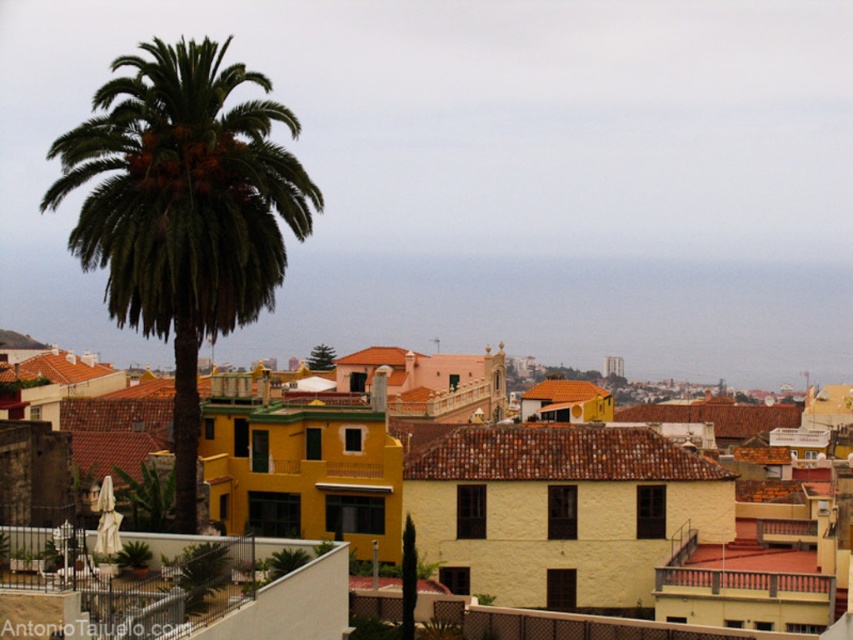
Question: Which point is farther from the camera taking this photo?

Choices:
 (A) (119, 625)
 (B) (262, 83)

Answer: (B)

Question: Does green leafy palm at left appear on the left side of white wrought iron balcony at lower left?

Choices:
 (A) yes
 (B) no

Answer: (A)

Question: Among these objects, which one is nearest to the camera?

Choices:
 (A) green leafy palm at left
 (B) white wrought iron balcony at lower left

Answer: (B)

Question: Observing the image, what is the correct spatial positioning of green leafy palm at left in reference to white wrought iron balcony at lower left?

Choices:
 (A) above
 (B) below

Answer: (A)

Question: Can you confirm if green leafy palm at left is positioned below white wrought iron balcony at lower left?

Choices:
 (A) no
 (B) yes

Answer: (A)